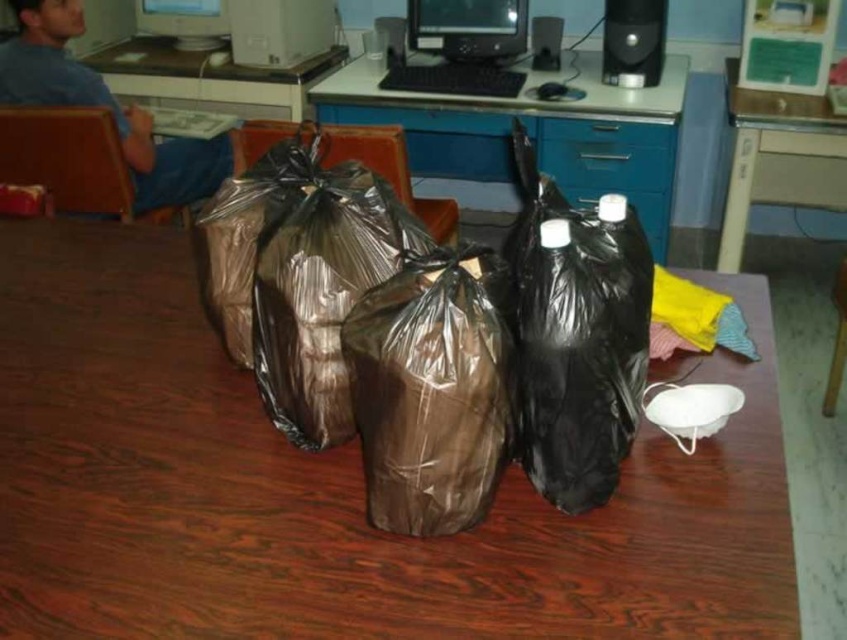
You are standing in the office scene and want to determine which of the two points, point (106,598) or point (440,227), is nearer to you. Based on the image, which point is closer?

Point (106,598) is closer to the camera than point (440,227), so the point closer to you is point (106,598).